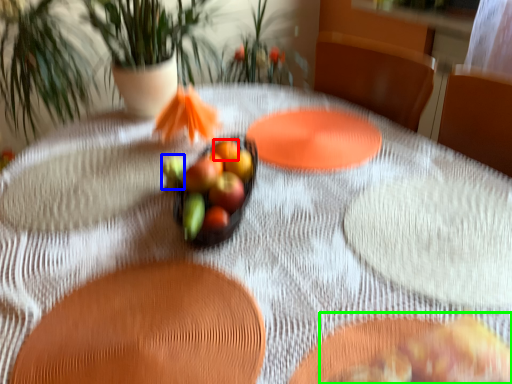
Question: Estimate the real-world distances between objects in this image. Which object is farther from fruit (highlighted by a red box), fruit (highlighted by a blue box) or food (highlighted by a green box)?

Choices:
 (A) fruit
 (B) food

Answer: (B)